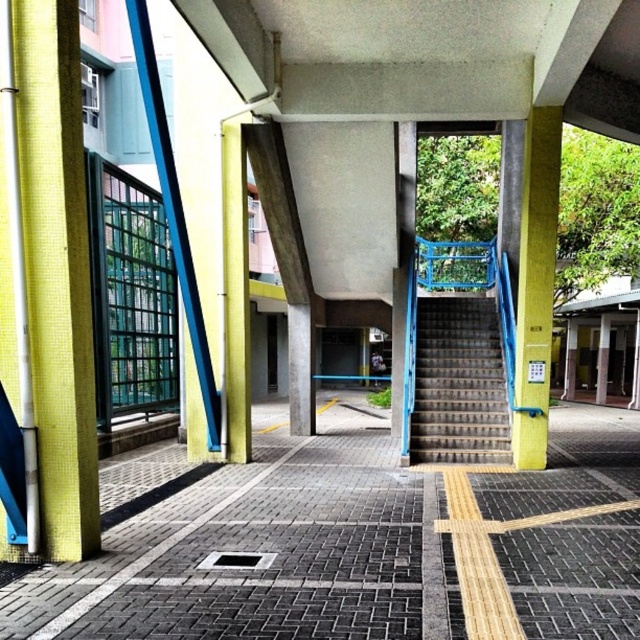
Between yellow mosaic tile pillar at left and yellow textured pillar at right, which one is positioned lower?

yellow mosaic tile pillar at left is lower down.

Who is higher up, yellow mosaic tile pillar at left or yellow textured pillar at right?

yellow textured pillar at right

Who is more forward, (29, 97) or (525, 268)?

Positioned in front is point (29, 97).

Locate an element on the screen. Image resolution: width=640 pixels, height=640 pixels. yellow mosaic tile pillar at left is located at coordinates (49, 273).

Measure the distance between metallic blue staircase at right and yellow mosaic tile pillar at center.

metallic blue staircase at right is 4.10 meters away from yellow mosaic tile pillar at center.

Looking at this image, does metallic blue staircase at right appear on the left side of yellow mosaic tile pillar at center?

No, metallic blue staircase at right is not to the left of yellow mosaic tile pillar at center.

Does point (442, 426) come in front of point (244, 317)?

No, it is behind (244, 317).

Locate an element on the screen. This screenshot has width=640, height=640. metallic blue staircase at right is located at coordinates (458, 384).

Which of these two, metallic blue staircase at right or yellow textured pillar at right, stands taller?

yellow textured pillar at right is taller.

Can you confirm if metallic blue staircase at right is thinner than yellow textured pillar at right?

No.

Describe the element at coordinates (458, 384) in the screenshot. I see `metallic blue staircase at right` at that location.

Locate an element on the screen. Image resolution: width=640 pixels, height=640 pixels. metallic blue staircase at right is located at coordinates (458, 384).